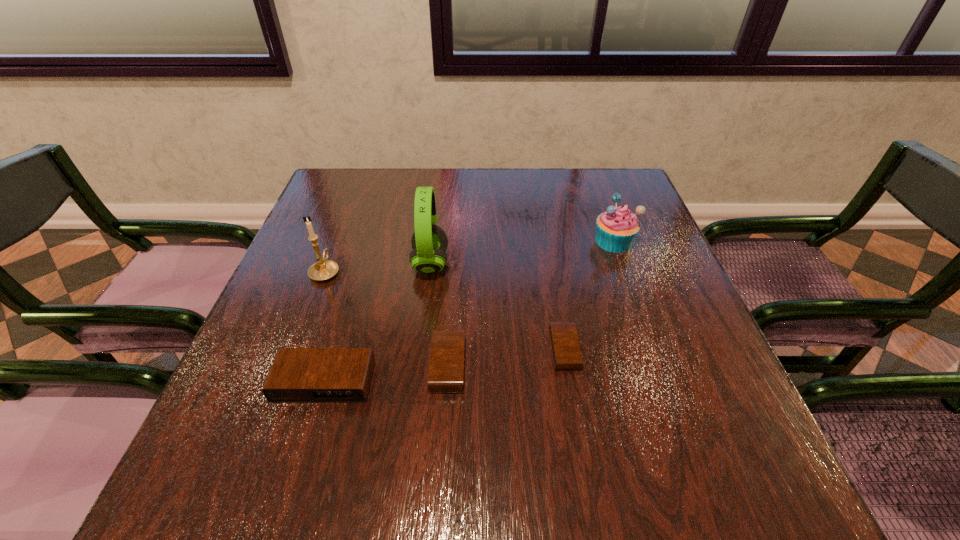
Please point out where to position a new alarm clock on the right to maintain spacing. Please provide its 2D coordinates. Your answer should be formatted as a tuple, i.e. [(x, y)], where the tuple contains the x and y coordinates of a point satisfying the conditions above.

[(674, 335)]